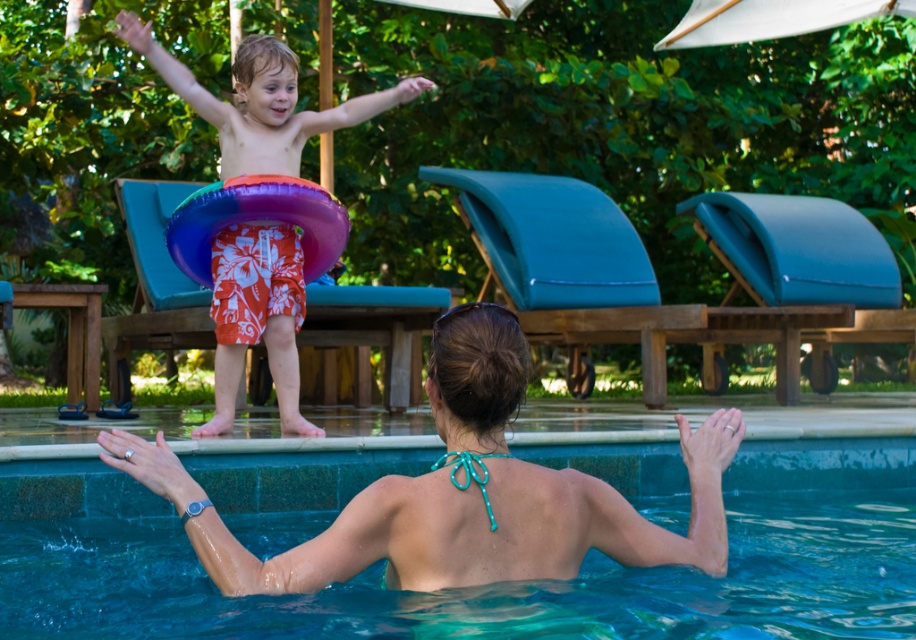
Does teal fabric bikini top at upper center have a lesser width compared to orange floral shorts at upper center?

Incorrect, teal fabric bikini top at upper center's width is not less than orange floral shorts at upper center's.

Can you confirm if teal fabric bikini top at upper center is smaller than orange floral shorts at upper center?

Correct, teal fabric bikini top at upper center occupies less space than orange floral shorts at upper center.

Which is behind, point (329, 568) or point (256, 268)?

Point (256, 268)

Find the location of a particular element. teal fabric bikini top at upper center is located at coordinates (460, 492).

Who is positioned more to the left, blue smooth water at upper center or teal fabric bikini top at upper center?

Positioned to the left is blue smooth water at upper center.

Who is lower down, blue smooth water at upper center or teal fabric bikini top at upper center?

blue smooth water at upper center

Between point (31, 630) and point (449, 492), which one is positioned in front?

Positioned in front is point (449, 492).

Where is `blue smooth water at upper center`? blue smooth water at upper center is located at coordinates (491, 586).

Measure the distance between point (97,497) and camera.

A distance of 21.39 feet exists between point (97,497) and camera.

Is blue smooth water at upper center positioned behind orange floral shorts at upper center?

No, it is not.

Who is more forward, (120, 625) or (320, 109)?

Point (120, 625) is in front.

Image resolution: width=916 pixels, height=640 pixels. I want to click on blue smooth water at upper center, so 491,586.